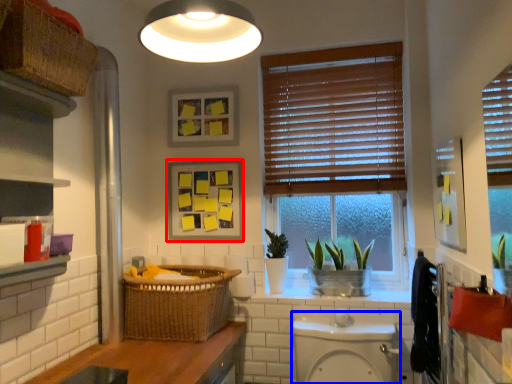
Question: Which object is closer to the camera taking this photo, picture frame (highlighted by a red box) or toilet bowl (highlighted by a blue box)?

Choices:
 (A) picture frame
 (B) toilet bowl

Answer: (B)